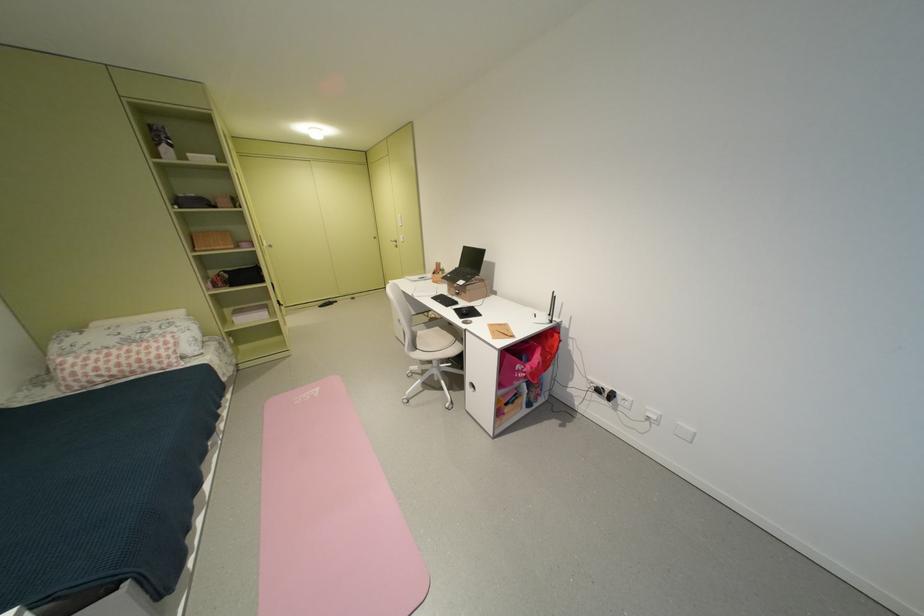
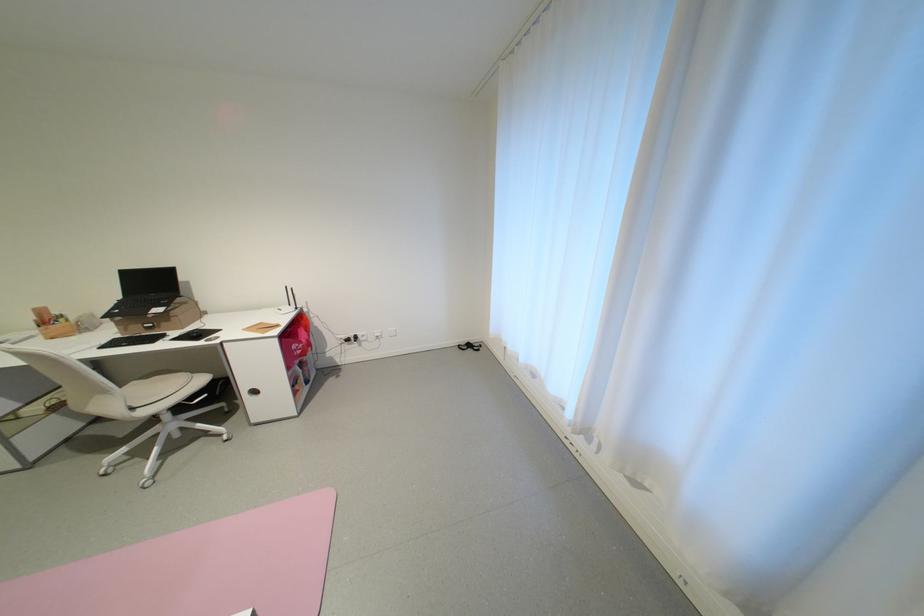
Question: The camera is either moving clockwise (left) or counter-clockwise (right) around the object. The first image is from the beginning of the video and the second image is from the end. Is the camera moving left or right when shooting the video?

Choices:
 (A) Left
 (B) Right

Answer: (A)